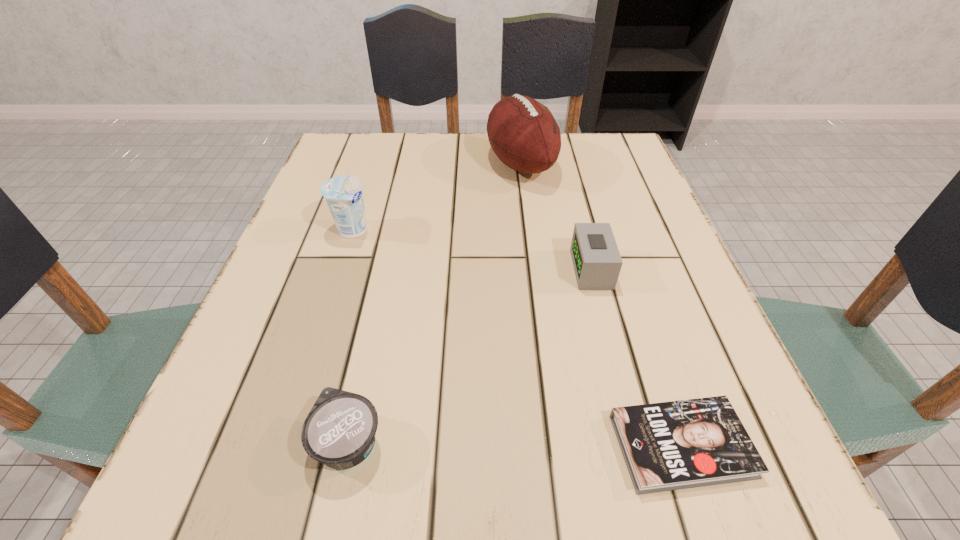
At what (x,y) coordinates should I click in order to perform the action: click on free space that satisfies the following two spatial constraints: 1. on the front-facing side of the third shortest object; 2. on the front side of the shorter yogurt. Please return your answer as a coordinate pair (x, y). The width and height of the screenshot is (960, 540). Looking at the image, I should click on (636, 442).

Identify the location of free space that satisfies the following two spatial constraints: 1. on the front-facing side of the book; 2. on the left side of the third farthest object. (637, 446).

You are a GUI agent. You are given a task and a screenshot of the screen. Output one action in this format:
    pyautogui.click(x=<x>, y=<y>)
    Task: Click on the blank space that satisfies the following two spatial constraints: 1. on the front side of the book; 2. on the left side of the second farthest object
    The width and height of the screenshot is (960, 540).
    Given the screenshot: What is the action you would take?
    pyautogui.click(x=283, y=446)

Locate an element on the screen. The image size is (960, 540). free space that satisfies the following two spatial constraints: 1. on the back side of the tallest object; 2. on the left side of the shorter yogurt is located at coordinates [x=409, y=164].

You are a GUI agent. You are given a task and a screenshot of the screen. Output one action in this format:
    pyautogui.click(x=<x>, y=<y>)
    Task: Click on the vacant space that satisfies the following two spatial constraints: 1. on the front-facing side of the book; 2. on the right side of the alarm clock
    This screenshot has height=540, width=960.
    Given the screenshot: What is the action you would take?
    pyautogui.click(x=637, y=446)